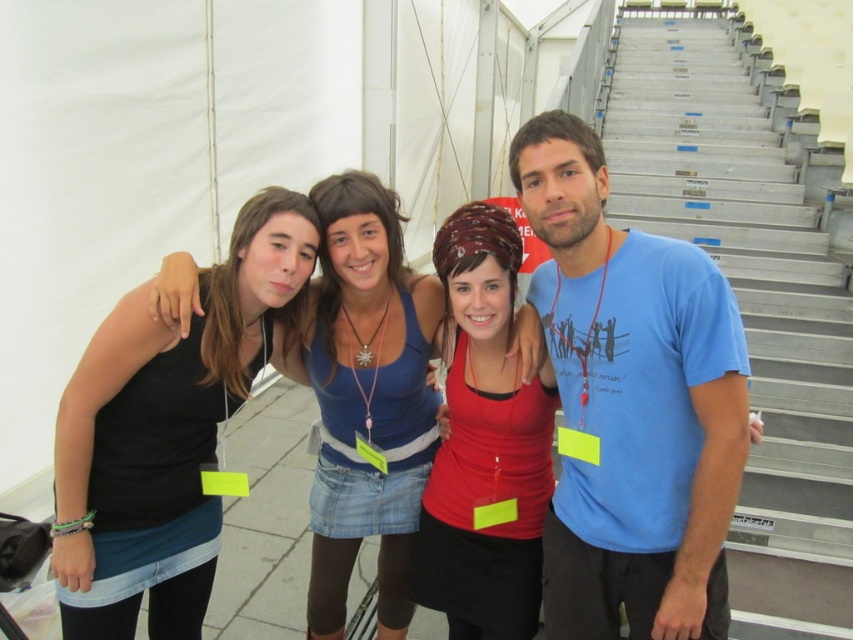
Question: Does blue cotton t-shirt at center have a lesser width compared to blue denim skirt at center?

Choices:
 (A) yes
 (B) no

Answer: (B)

Question: Which point appears closest to the camera in this image?

Choices:
 (A) (367, 392)
 (B) (604, 508)
 (C) (323, 278)
 (D) (251, 340)

Answer: (B)

Question: Which of the following is the closest to the observer?

Choices:
 (A) (369, 433)
 (B) (444, 278)
 (C) (111, 582)
 (D) (322, 420)

Answer: (C)

Question: Does metallic gray stairs at right appear over matte red tank top at center?

Choices:
 (A) yes
 (B) no

Answer: (A)

Question: Is blue cotton t-shirt at center to the left of blue denim skirt at center from the viewer's perspective?

Choices:
 (A) no
 (B) yes

Answer: (A)

Question: Which point is farther to the camera?

Choices:
 (A) blue cotton t-shirt at center
 (B) black denim tank top at left
 (C) denim skirt at center
 (D) metallic gray stairs at right

Answer: (D)